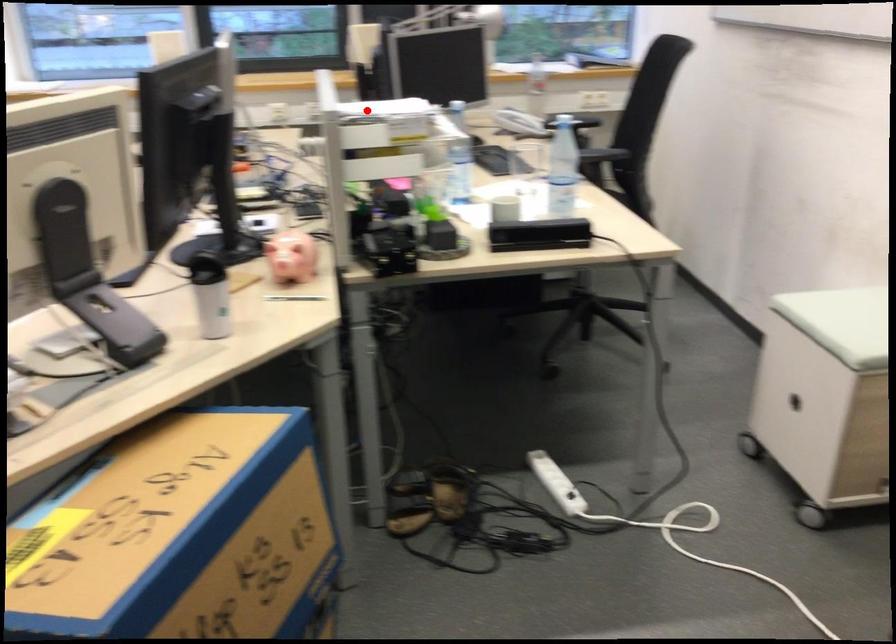
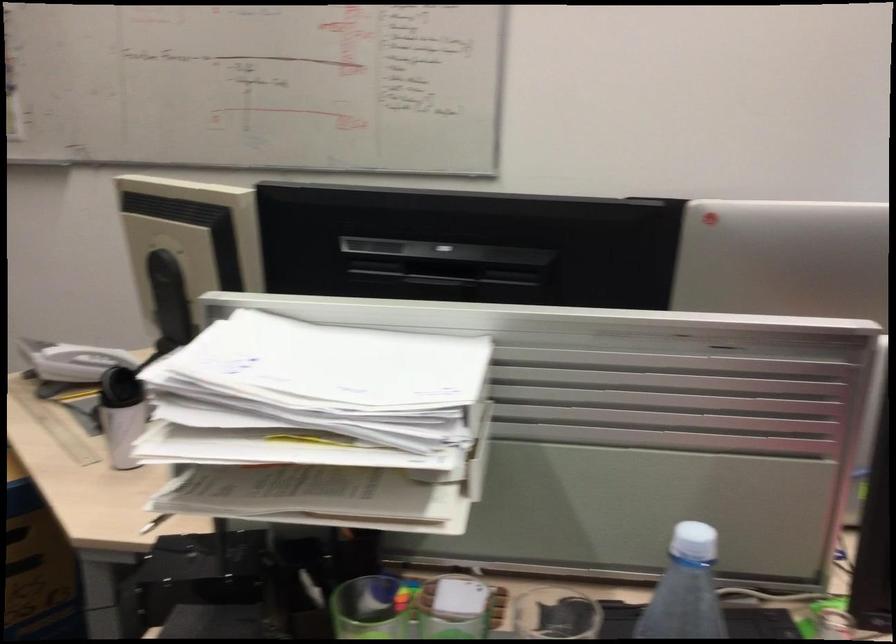
Question: I am providing you with two images of the same scene from different viewpoints. A red point is shown in image1. For the corresponding object point in image2, is it positioned nearer or farther from the camera?

Choices:
 (A) Nearer
 (B) Farther

Answer: (A)